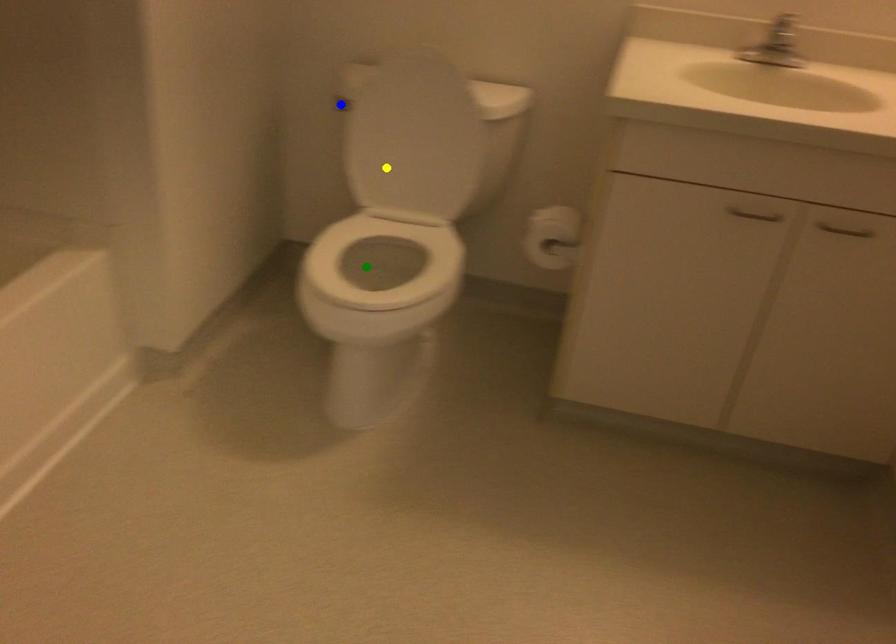
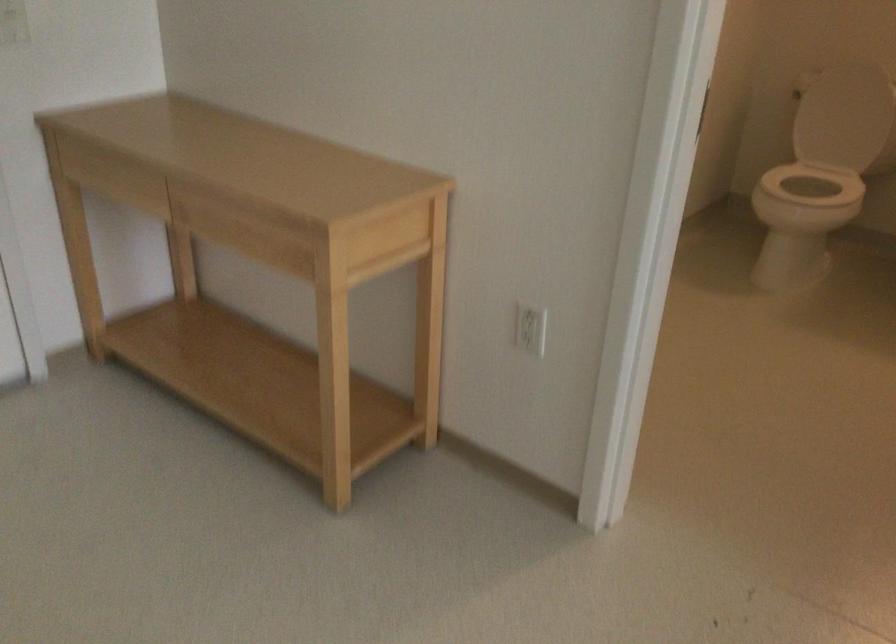
I am providing you with two images of the same scene from different viewpoints. Three points are marked in image1. Which point corresponds to a part or object that is occluded in image2?In image1, three points are marked. Which of them correspond to a part or object that is occluded in image2?Among the three points shown in image1, which one corresponds to a part or object that is no longer visible due to occlusion in image2?

blue point cannot be seen in image2.